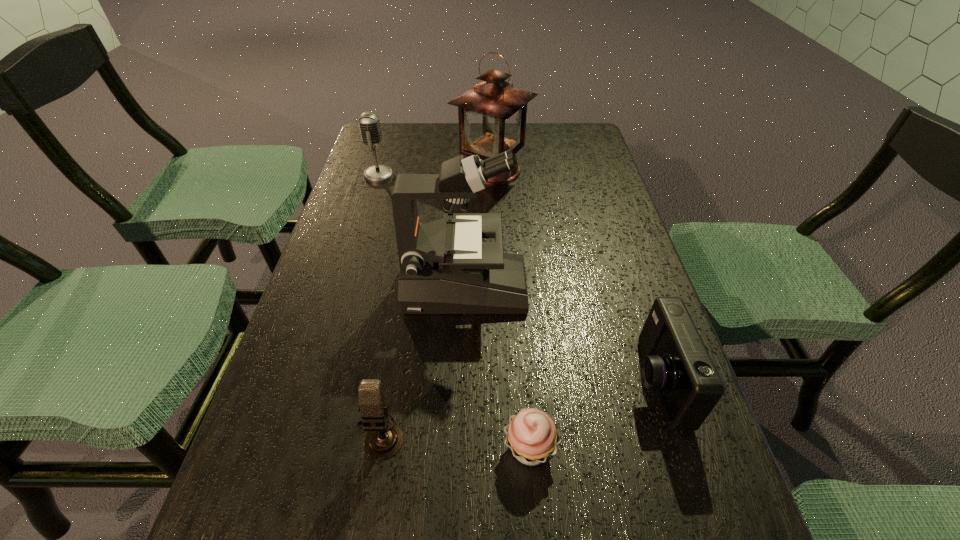
Where is `oil lamp`? oil lamp is located at coordinates (492, 114).

At what (x,y) coordinates should I click in order to perform the action: click on the fourth nearest object. Please return your answer as a coordinate pair (x, y). Looking at the image, I should click on (445, 268).

Find the location of `the leftmost object`. the leftmost object is located at coordinates (369, 124).

The image size is (960, 540). Find the location of `the third tallest object`. the third tallest object is located at coordinates (369, 124).

Where is `the shorter microphone`? The image size is (960, 540). the shorter microphone is located at coordinates (384, 439).

Where is `the right microphone`? The height and width of the screenshot is (540, 960). the right microphone is located at coordinates (384, 439).

Locate an element on the screen. Image resolution: width=960 pixels, height=540 pixels. camera is located at coordinates (676, 363).

Find the location of a particular element. The width and height of the screenshot is (960, 540). the shortest object is located at coordinates (532, 436).

Identify the location of vacant region located 0.150m on the front of the oil lamp. (494, 227).

The image size is (960, 540). I want to click on free space located 0.220m through the eyepieces of the microscope, so click(x=624, y=287).